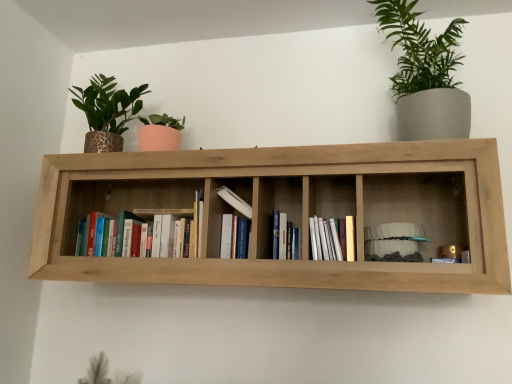
I want to click on white matte book at center, which appears as the 4th book when viewed from the right, so click(234, 201).

The height and width of the screenshot is (384, 512). What do you see at coordinates (393, 239) in the screenshot?
I see `white matte stack of plates at right, marked as the 1th book in a right-to-left arrangement` at bounding box center [393, 239].

What is the approximate width of hardcover books at center, the first book positioned from the left?

17.30 centimeters.

Find the location of a particular element. The width and height of the screenshot is (512, 384). natural wood shelf at center is located at coordinates (285, 210).

From a real-world perspective, is white paper at center, which ranks as the second book in right-to-left order, below hardcover book at center, which is the 3th book in left-to-right order?

Yes, from a real-world perspective, white paper at center, which ranks as the second book in right-to-left order, is below hardcover book at center, which is the 3th book in left-to-right order.

Is white paper at center, which ranks as the second book in right-to-left order, wider or thinner than hardcover book at center, which is the 3th book in left-to-right order?

Clearly, white paper at center, which ranks as the second book in right-to-left order, has more width compared to hardcover book at center, which is the 3th book in left-to-right order.

Which is closer to the camera, (352, 242) or (274, 241)?

Point (352, 242).

Would you say white paper at center, which ranks as the second book in right-to-left order, is inside or outside hardcover book at center, which is the 3th book in left-to-right order?

white paper at center, which ranks as the second book in right-to-left order, lies outside hardcover book at center, which is the 3th book in left-to-right order.

The height and width of the screenshot is (384, 512). What are the coordinates of `shelf in front of the white paper at center, positioned as the fourth book in left-to-right order` in the screenshot? It's located at pos(285,210).

Would you consider natural wood shelf at center to be distant from white paper at center, which ranks as the second book in right-to-left order?

That's not correct — natural wood shelf at center is a little close to white paper at center, which ranks as the second book in right-to-left order.

From the picture: In terms of height, does natural wood shelf at center look taller or shorter compared to white paper at center, positioned as the fourth book in left-to-right order?

In the image, natural wood shelf at center appears to be taller than white paper at center, positioned as the fourth book in left-to-right order.

From a real-world perspective, is natural wood shelf at center physically located above or below white paper at center, which ranks as the second book in right-to-left order?

In terms of real-world spatial position, natural wood shelf at center is above white paper at center, which ranks as the second book in right-to-left order.

Which is more to the right, white matte stack of plates at right, marked as the 1th book in a right-to-left arrangement, or natural wood shelf at center?

white matte stack of plates at right, marked as the 1th book in a right-to-left arrangement.

From a real-world perspective, which object stands above the other?

In real-world perspective, natural wood shelf at center is above.

How far apart are white matte stack of plates at right, marked as the 1th book in a right-to-left arrangement, and natural wood shelf at center?

white matte stack of plates at right, marked as the 1th book in a right-to-left arrangement, is 14.93 inches away from natural wood shelf at center.

Are white matte stack of plates at right, marked as the 1th book in a right-to-left arrangement, and natural wood shelf at center beside each other?

No, white matte stack of plates at right, marked as the 1th book in a right-to-left arrangement, is not in contact with natural wood shelf at center.

Is white matte book at center, which appears as the 4th book when viewed from the right, at the back of hardcover books at center, the first book positioned from the left?

No, white matte book at center, which appears as the 4th book when viewed from the right, is not at the back of hardcover books at center, the first book positioned from the left.

From the image's perspective, is hardcover books at center, which ranks as the fifth book in right-to-left order, located above or below white matte book at center, the 2th book viewed from the left?

hardcover books at center, which ranks as the fifth book in right-to-left order, is situated lower than white matte book at center, the 2th book viewed from the left, in the image.

Consider the image. Can white matte book at center, which appears as the 4th book when viewed from the right, be found inside hardcover books at center, the first book positioned from the left?

No, white matte book at center, which appears as the 4th book when viewed from the right, is not a part of hardcover books at center, the first book positioned from the left.

How different are the orientations of hardcover books at center, the first book positioned from the left, and white matte book at center, which appears as the 4th book when viewed from the right, in degrees?

There is a 0.00209-degree angle between the facing directions of hardcover books at center, the first book positioned from the left, and white matte book at center, which appears as the 4th book when viewed from the right.

Does white matte stack of plates at right, marked as the 1th book in a right-to-left arrangement, have a smaller size compared to white paper at center, which ranks as the second book in right-to-left order?

Yes, white matte stack of plates at right, marked as the 1th book in a right-to-left arrangement, is smaller than white paper at center, which ranks as the second book in right-to-left order.

Does white matte stack of plates at right, marked as the 1th book in a right-to-left arrangement, come in front of white paper at center, positioned as the fourth book in left-to-right order?

No, white matte stack of plates at right, marked as the 1th book in a right-to-left arrangement, is further to the viewer.

Is white matte stack of plates at right, arranged as the 5th book when viewed from the left, completely or partially outside of white paper at center, positioned as the fourth book in left-to-right order?

white matte stack of plates at right, arranged as the 5th book when viewed from the left, is positioned outside white paper at center, positioned as the fourth book in left-to-right order.

Which object is further away from the camera, green matte plant at upper right or white paper at center, which ranks as the second book in right-to-left order?

green matte plant at upper right is behind.

Is green matte plant at upper right not near white paper at center, which ranks as the second book in right-to-left order?

No.

Does green matte plant at upper right appear on the left side of white paper at center, positioned as the fourth book in left-to-right order?

In fact, green matte plant at upper right is to the right of white paper at center, positioned as the fourth book in left-to-right order.

Does hardcover book at center, marked as the third book in a right-to-left arrangement, have a smaller size compared to white matte book at center, which appears as the 4th book when viewed from the right?

Yes, hardcover book at center, marked as the third book in a right-to-left arrangement, is smaller than white matte book at center, which appears as the 4th book when viewed from the right.

Can you confirm if hardcover book at center, which is the 3th book in left-to-right order, is positioned to the left of white matte book at center, which appears as the 4th book when viewed from the right?

No.

Can you confirm if hardcover book at center, marked as the third book in a right-to-left arrangement, is wider than white matte book at center, which appears as the 4th book when viewed from the right?

Indeed, hardcover book at center, marked as the third book in a right-to-left arrangement, has a greater width compared to white matte book at center, which appears as the 4th book when viewed from the right.

From a real-world perspective, relative to white matte book at center, the 2th book viewed from the left, is hardcover book at center, marked as the third book in a right-to-left arrangement, vertically above or below?

From a real-world perspective, hardcover book at center, marked as the third book in a right-to-left arrangement, is physically below white matte book at center, the 2th book viewed from the left.

Find the location of a particular element. book that is the 4th object located behind the white paper at center, positioned as the fourth book in left-to-right order is located at coordinates (285, 238).

You are a GUI agent. You are given a task and a screenshot of the screen. Output one action in this format:
    pyautogui.click(x=<x>, y=<y>)
    Task: Click on the 2nd book to the right of the natural wood shelf at center, counting from the anchor's position
    This screenshot has height=384, width=512.
    Given the screenshot: What is the action you would take?
    [x=331, y=239]

Based on their spatial positions, is hardcover books at center, which ranks as the fifth book in right-to-left order, or hardcover book at center, marked as the third book in a right-to-left arrangement, further from green matte plant at upper right?

hardcover books at center, which ranks as the fifth book in right-to-left order, is positioned further to the anchor green matte plant at upper right.

From the image, which object appears to be nearer to hardcover books at center, the first book positioned from the left, white matte book at center, the 2th book viewed from the left, or hardcover book at center, which is the 3th book in left-to-right order?

The object closer to hardcover books at center, the first book positioned from the left, is white matte book at center, the 2th book viewed from the left.

When comparing their distances from hardcover books at center, which ranks as the fifth book in right-to-left order, does green matte plant at upper right or white matte stack of plates at right, arranged as the 5th book when viewed from the left, seem closer?

white matte stack of plates at right, arranged as the 5th book when viewed from the left.

Considering their positions, is green matte plant at upper right positioned closer to white matte book at center, the 2th book viewed from the left, than natural wood shelf at center?

natural wood shelf at center is positioned closer to the anchor white matte book at center, the 2th book viewed from the left.

Looking at the image, which one is located further to natural wood shelf at center, hardcover book at center, which is the 3th book in left-to-right order, or green matte plant at upper right?

green matte plant at upper right is further to natural wood shelf at center.

From the picture: When comparing their distances from hardcover book at center, marked as the third book in a right-to-left arrangement, does white matte book at center, which appears as the 4th book when viewed from the right, or hardcover books at center, which ranks as the fifth book in right-to-left order, seem further?

Based on the image, hardcover books at center, which ranks as the fifth book in right-to-left order, appears to be further to hardcover book at center, marked as the third book in a right-to-left arrangement.

Which object lies nearer to the anchor point hardcover book at center, which is the 3th book in left-to-right order, white paper at center, which ranks as the second book in right-to-left order, or natural wood shelf at center?

white paper at center, which ranks as the second book in right-to-left order, is closer to hardcover book at center, which is the 3th book in left-to-right order.

When comparing their distances from white paper at center, which ranks as the second book in right-to-left order, does white matte stack of plates at right, marked as the 1th book in a right-to-left arrangement, or hardcover books at center, the first book positioned from the left, seem closer?

The object closer to white paper at center, which ranks as the second book in right-to-left order, is white matte stack of plates at right, marked as the 1th book in a right-to-left arrangement.

Where is `shelf situated between hardcover books at center, which ranks as the fifth book in right-to-left order, and white matte stack of plates at right, marked as the 1th book in a right-to-left arrangement, from left to right`? shelf situated between hardcover books at center, which ranks as the fifth book in right-to-left order, and white matte stack of plates at right, marked as the 1th book in a right-to-left arrangement, from left to right is located at coordinates (285, 210).

The width and height of the screenshot is (512, 384). Find the location of `shelf situated between hardcover books at center, which ranks as the fifth book in right-to-left order, and green matte plant at upper right from left to right`. shelf situated between hardcover books at center, which ranks as the fifth book in right-to-left order, and green matte plant at upper right from left to right is located at coordinates (285, 210).

Where is `book situated between hardcover book at center, marked as the third book in a right-to-left arrangement, and white matte stack of plates at right, arranged as the 5th book when viewed from the left, from left to right`? The width and height of the screenshot is (512, 384). book situated between hardcover book at center, marked as the third book in a right-to-left arrangement, and white matte stack of plates at right, arranged as the 5th book when viewed from the left, from left to right is located at coordinates (331, 239).

The width and height of the screenshot is (512, 384). Find the location of `book between hardcover books at center, the first book positioned from the left, and hardcover book at center, which is the 3th book in left-to-right order, from left to right`. book between hardcover books at center, the first book positioned from the left, and hardcover book at center, which is the 3th book in left-to-right order, from left to right is located at coordinates (234, 201).